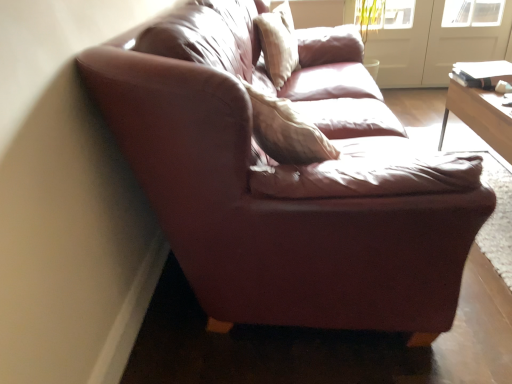
From a real-world perspective, point to a free spot above white glossy screen door at upper right, arranged as the 1th screen door when viewed from the left.

[(0.768, -0.001)]